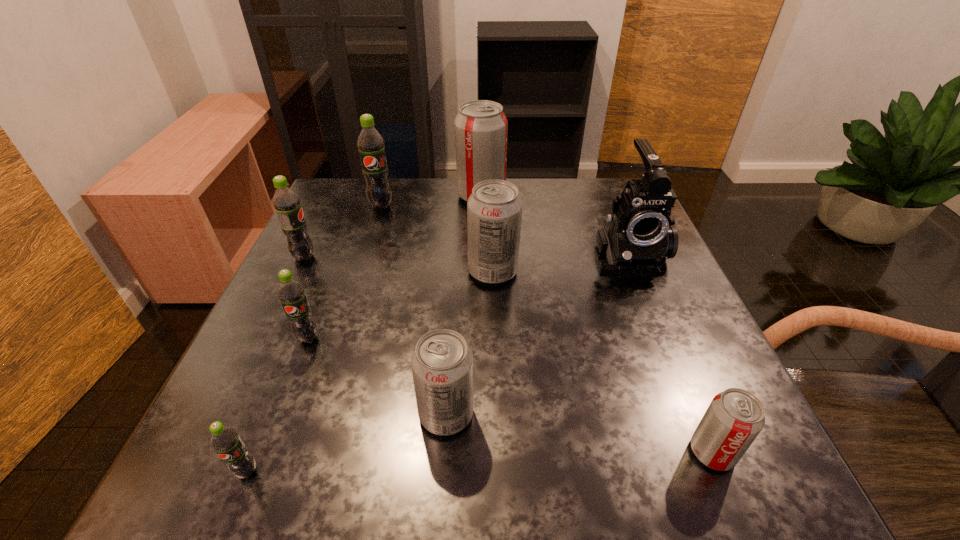
Find the location of a particular element. vacant space that's between the farthest gray soda can and the camcorder is located at coordinates (554, 226).

Where is `vacant area that lies between the fourth nearest object and the fifth soda can from right to left`? This screenshot has height=540, width=960. vacant area that lies between the fourth nearest object and the fifth soda can from right to left is located at coordinates (345, 272).

Identify the location of the fifth closest object to the camcorder. Image resolution: width=960 pixels, height=540 pixels. (370, 143).

Identify which object is located as the third nearest to the fourth nearest object. Please provide its 2D coordinates. Your answer should be formatted as a tuple, i.e. [(x, y)], where the tuple contains the x and y coordinates of a point satisfying the conditions above.

[(442, 363)]

Locate which soda can is the closest to the second smallest gray soda can. Please provide its 2D coordinates. Your answer should be formatted as a tuple, i.e. [(x, y)], where the tuple contains the x and y coordinates of a point satisfying the conditions above.

[(291, 293)]

The image size is (960, 540). Find the location of `soda can that stands as the seventh closest to the fourth nearest soda can`. soda can that stands as the seventh closest to the fourth nearest soda can is located at coordinates (734, 418).

Where is `gray soda can that is the third closest to the farthest gray soda can`? The width and height of the screenshot is (960, 540). gray soda can that is the third closest to the farthest gray soda can is located at coordinates (734, 418).

Locate which gray soda can ranks fourth in proximity to the camcorder. Please provide its 2D coordinates. Your answer should be formatted as a tuple, i.e. [(x, y)], where the tuple contains the x and y coordinates of a point satisfying the conditions above.

[(442, 363)]

Where is `green soda that is the closest to the smallest gray soda can`? green soda that is the closest to the smallest gray soda can is located at coordinates (226, 442).

The width and height of the screenshot is (960, 540). Find the location of `green soda that is the closest one to the camcorder`. green soda that is the closest one to the camcorder is located at coordinates (370, 143).